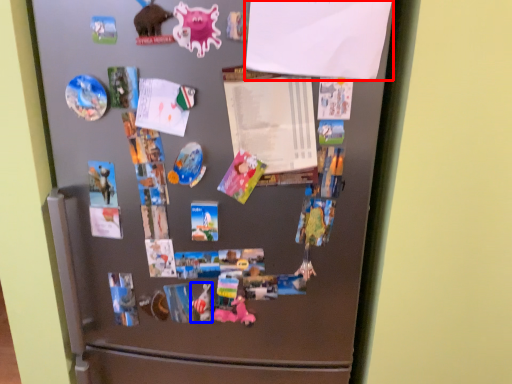
Question: Which object appears closest to the camera in this image, paper (highlighted by a red box) or art (highlighted by a blue box)?

Choices:
 (A) paper
 (B) art

Answer: (A)